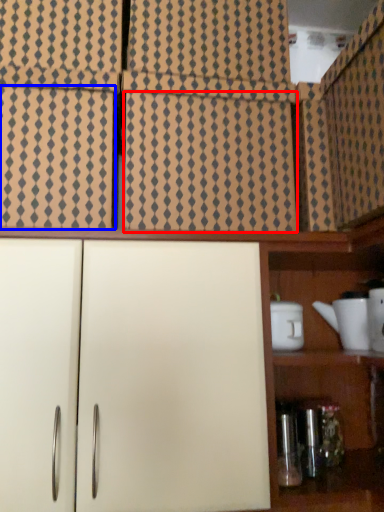
Question: Which of the following is the closest to the observer, tile (highlighted by a red box) or cabinetry (highlighted by a blue box)?

Choices:
 (A) tile
 (B) cabinetry

Answer: (B)